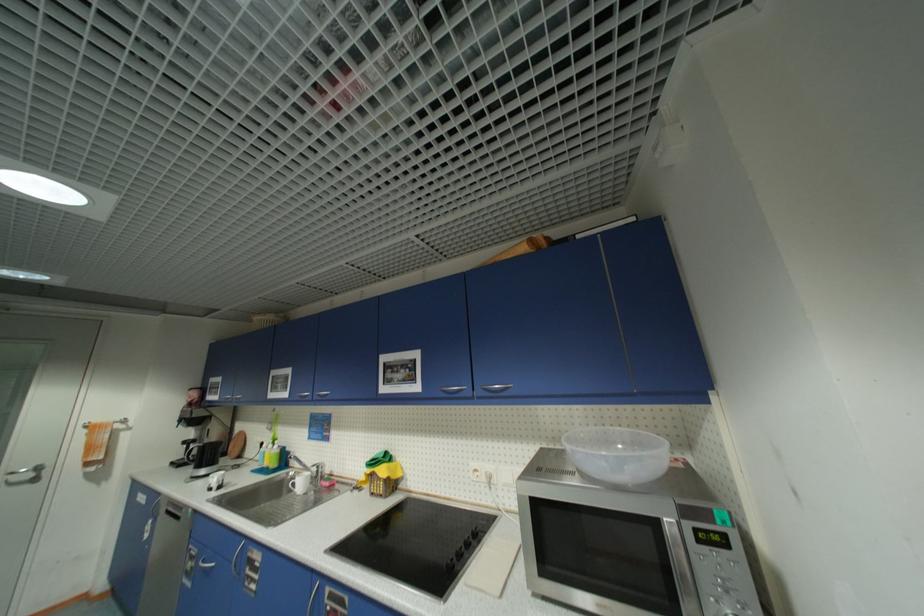
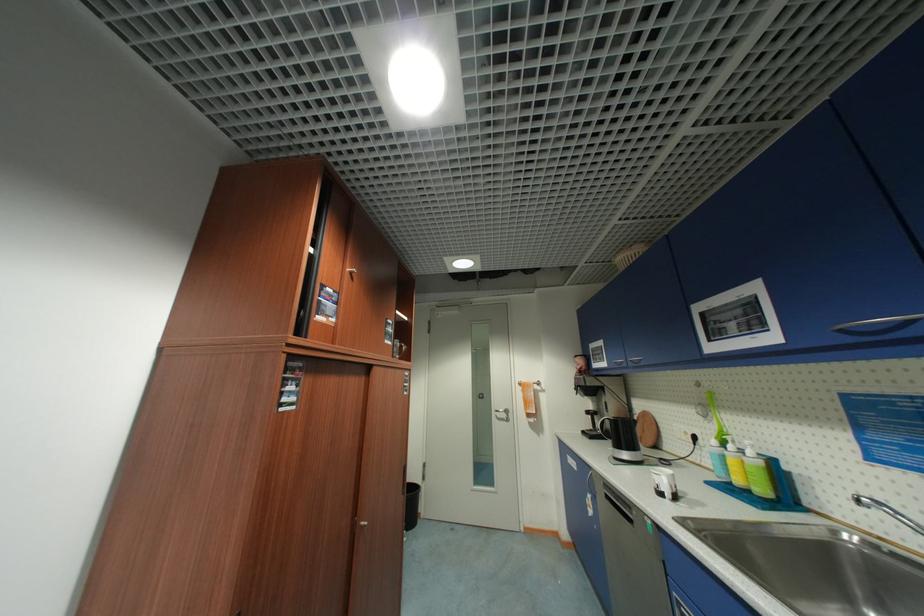
Where in the second image is the point corresponding to (x=272, y=464) from the first image?

(744, 482)